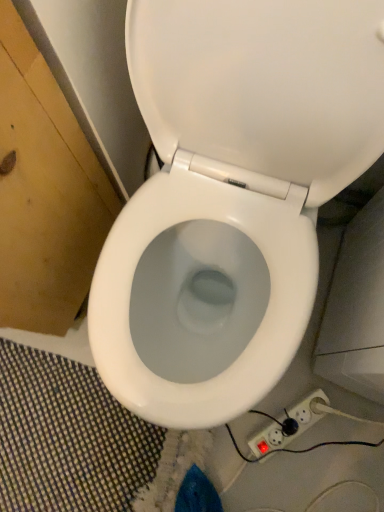
Question: Should I look upward or downward to see white plastic power strip at lower right?

Choices:
 (A) up
 (B) down

Answer: (B)

Question: Is white glossy toilet at center taller than white plastic power strip at lower right?

Choices:
 (A) no
 (B) yes

Answer: (B)

Question: Is the surface of white glossy toilet at center in direct contact with white plastic power strip at lower right?

Choices:
 (A) yes
 (B) no

Answer: (B)

Question: Considering the relative sizes of white glossy toilet at center and white plastic power strip at lower right in the image provided, is white glossy toilet at center shorter than white plastic power strip at lower right?

Choices:
 (A) yes
 (B) no

Answer: (B)

Question: Does white glossy toilet at center appear on the right side of white plastic power strip at lower right?

Choices:
 (A) no
 (B) yes

Answer: (A)

Question: Is white glossy toilet at center positioned far away from white plastic power strip at lower right?

Choices:
 (A) yes
 (B) no

Answer: (B)

Question: Is white glossy toilet at center outside of white plastic power strip at lower right?

Choices:
 (A) yes
 (B) no

Answer: (A)

Question: Is white plastic power strip at lower right facing towards white glossy toilet at center?

Choices:
 (A) yes
 (B) no

Answer: (B)

Question: Does white plastic power strip at lower right have a greater height compared to white glossy toilet at center?

Choices:
 (A) yes
 (B) no

Answer: (B)

Question: Is white plastic power strip at lower right at the right side of white glossy toilet at center?

Choices:
 (A) no
 (B) yes

Answer: (B)

Question: Does white plastic power strip at lower right have a lesser width compared to white glossy toilet at center?

Choices:
 (A) no
 (B) yes

Answer: (B)

Question: Does white plastic power strip at lower right lie behind white glossy toilet at center?

Choices:
 (A) yes
 (B) no

Answer: (A)

Question: Is white plastic power strip at lower right completely or partially outside of white glossy toilet at center?

Choices:
 (A) no
 (B) yes

Answer: (B)

Question: Is white plastic power strip at lower right in front of or behind white glossy toilet at center in the image?

Choices:
 (A) front
 (B) behind

Answer: (B)